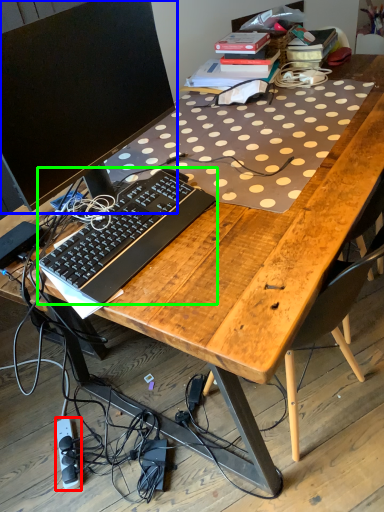
Question: Estimate the real-world distances between objects in this image. Which object is farther from equipment (highlighted by a red box), computer monitor (highlighted by a blue box) or computer keyboard (highlighted by a green box)?

Choices:
 (A) computer monitor
 (B) computer keyboard

Answer: (A)